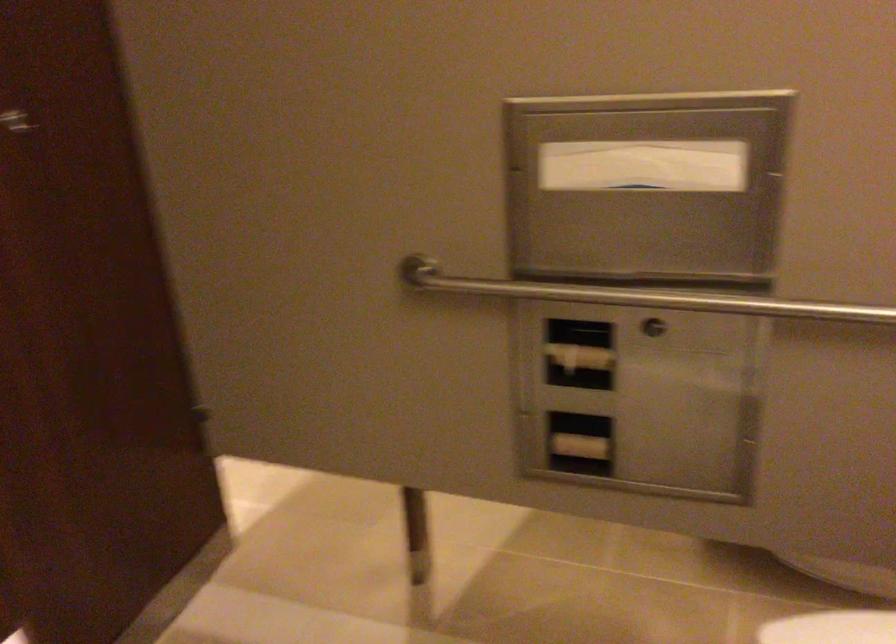
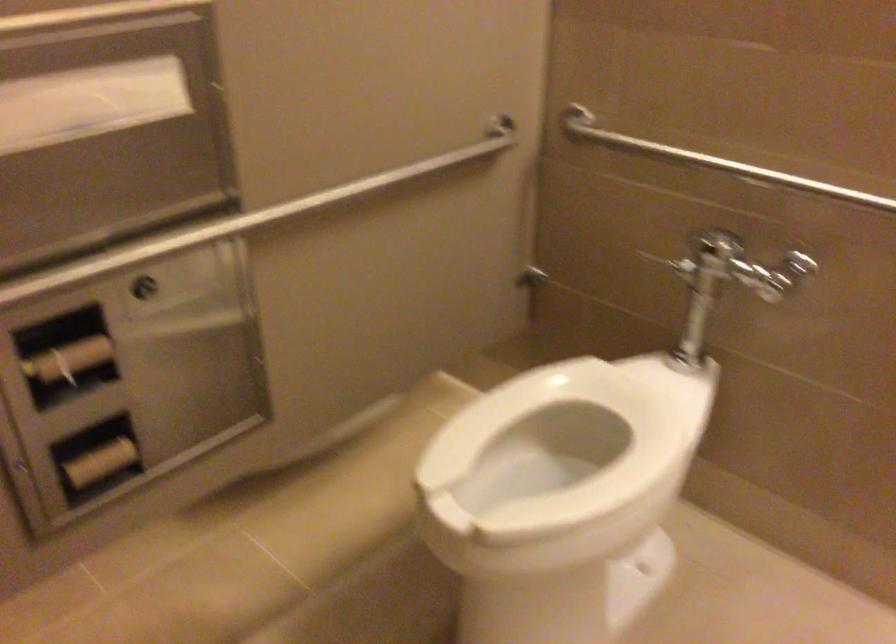
Find the pixel in the second image that matches the point at 575,444 in the first image.

(99, 462)